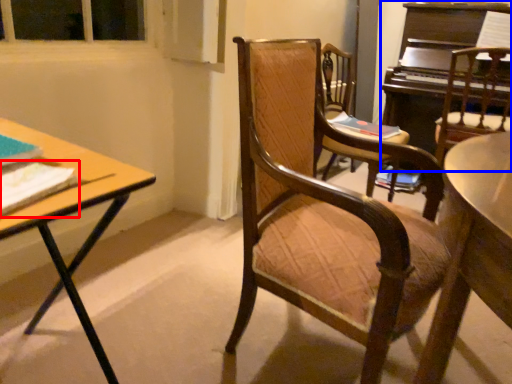
Question: Which of the following is the farthest to the observer, book (highlighted by a red box) or piano (highlighted by a blue box)?

Choices:
 (A) book
 (B) piano

Answer: (B)